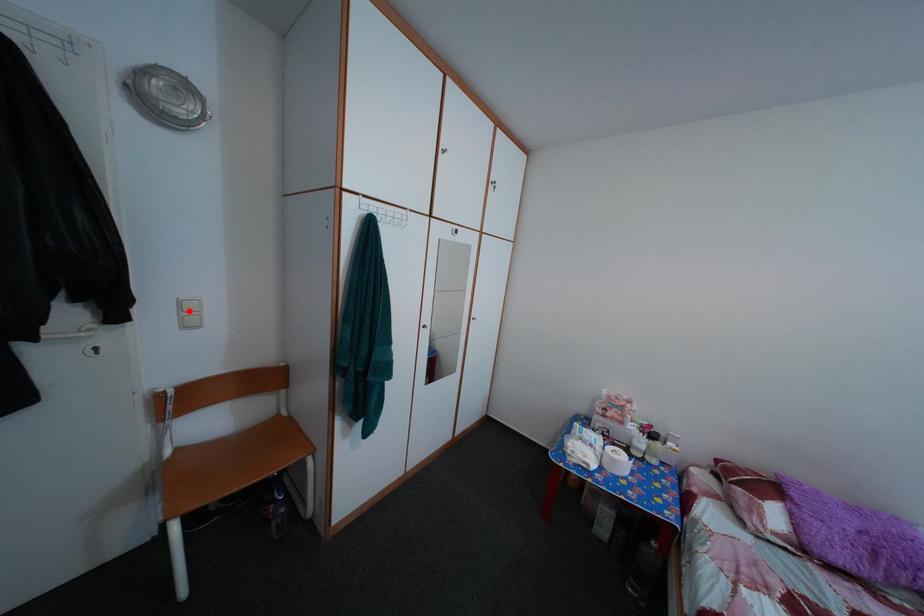
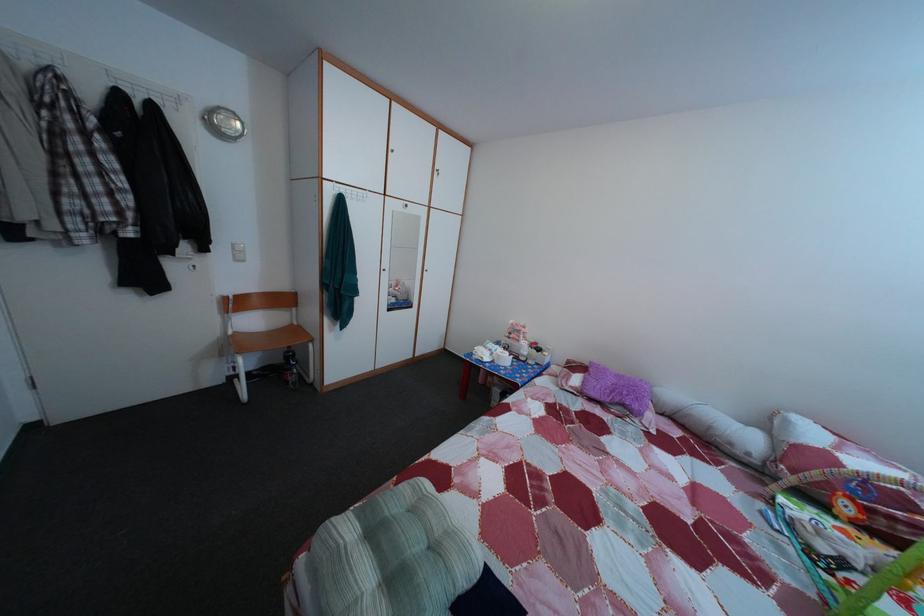
Where in the second image is the point corresponding to the highlighted location from the first image?

(242, 254)